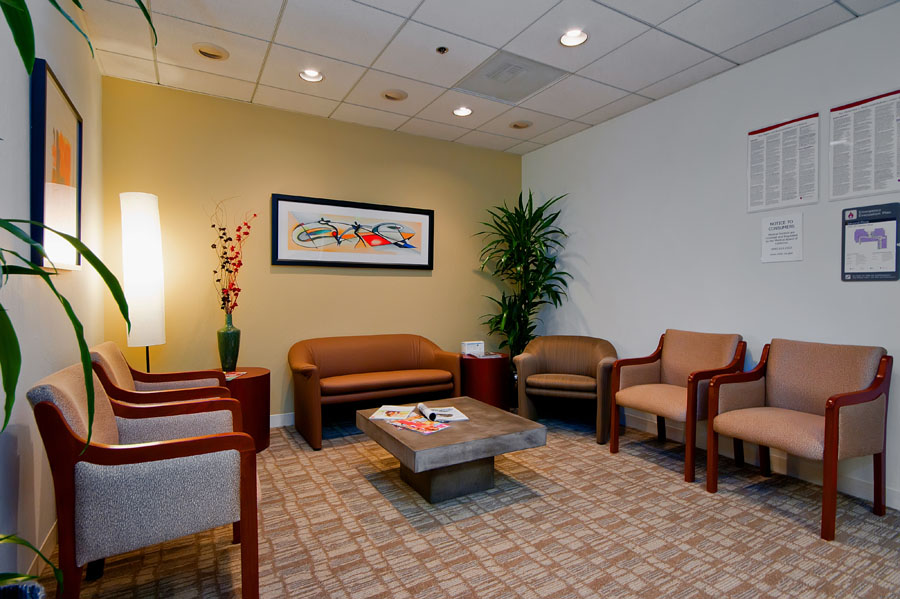
The height and width of the screenshot is (599, 900). What are the coordinates of `table` in the screenshot? It's located at (501, 426).